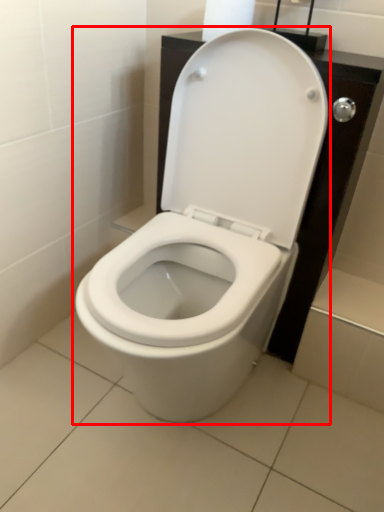
Question: Observing the image, what is the correct spatial positioning of toilet (annotated by the red box) in reference to toilet paper?

Choices:
 (A) right
 (B) left

Answer: (B)